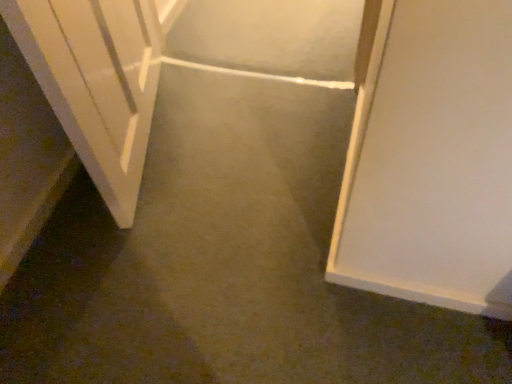
Image resolution: width=512 pixels, height=384 pixels. What do you see at coordinates (96, 83) in the screenshot?
I see `white glossy door at left` at bounding box center [96, 83].

You are a GUI agent. You are given a task and a screenshot of the screen. Output one action in this format:
    pyautogui.click(x=<x>, y=<y>)
    Task: Click on the white glossy door at left
    
    Given the screenshot: What is the action you would take?
    pyautogui.click(x=96, y=83)

In order to face white glossy door at left, should I rotate leftwards or rightwards?

To align with it, rotate left about 18.182°.

Measure the distance between point (137, 18) and camera.

Point (137, 18) is 4.30 feet away from camera.

Locate an element on the screen. This screenshot has height=384, width=512. white glossy door at left is located at coordinates (96, 83).